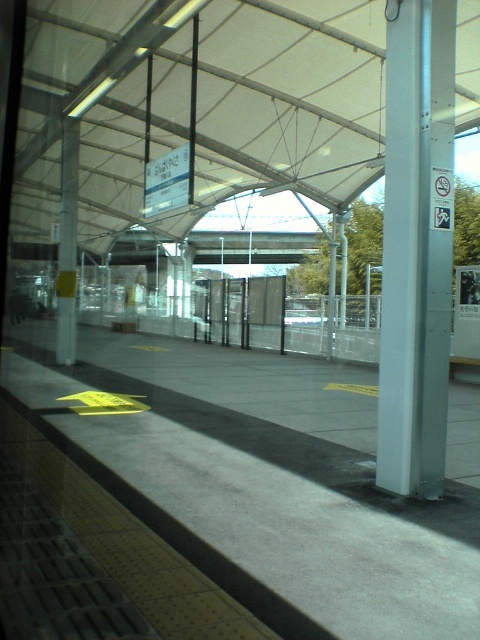
Between white fabric canopy at upper center and silver metallic pole at right, which one has less height?

white fabric canopy at upper center

Is point (59, 61) positioned before point (394, 420)?

No, (59, 61) is behind (394, 420).

At what (x,y) coordinates should I click in order to perform the action: click on white fabric canopy at upper center. Please return your answer as a coordinate pair (x, y). The image size is (480, 640). Looking at the image, I should click on (202, 102).